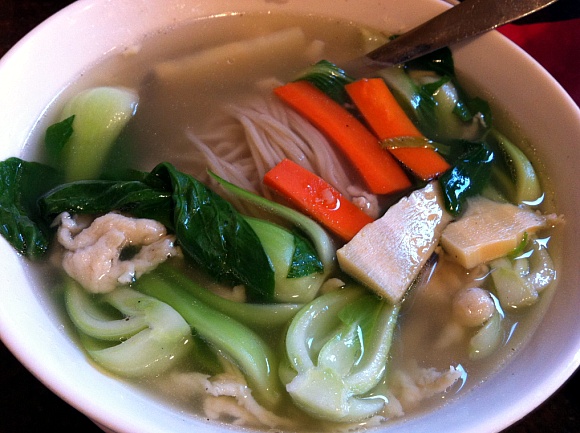
This screenshot has width=580, height=433. I want to click on utensil, so click(x=414, y=46).